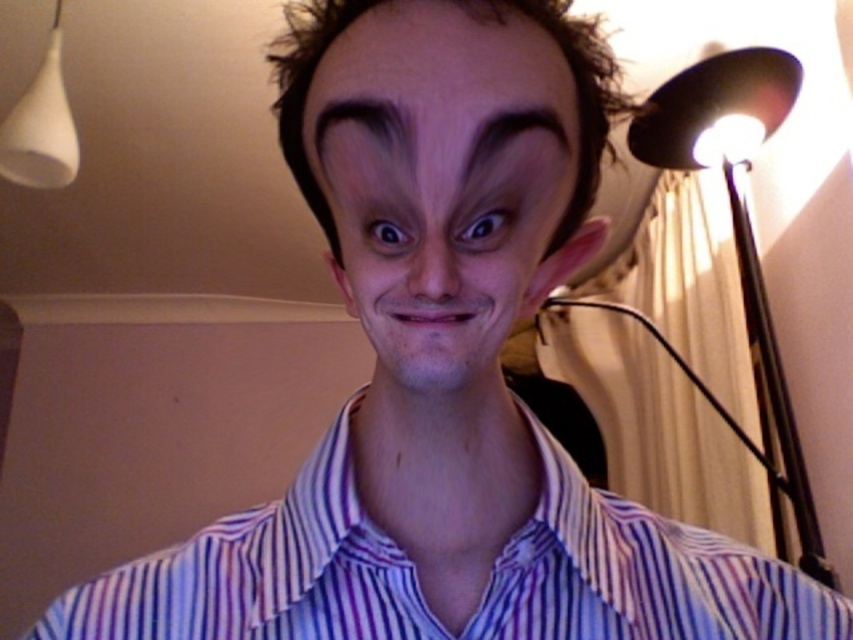
Question: Is black metal floor lamp at right in front of white matte lampshade at upper left?

Choices:
 (A) no
 (B) yes

Answer: (B)

Question: Which object appears farthest from the camera in this image?

Choices:
 (A) smooth skin face at center
 (B) dark brown hair at upper center

Answer: (B)

Question: Is purple striped shirt at center above dark brown hair at upper center?

Choices:
 (A) yes
 (B) no

Answer: (B)

Question: Which point is closer to the camera taking this photo?

Choices:
 (A) (288, 499)
 (B) (456, 266)

Answer: (B)

Question: Observing the image, what is the correct spatial positioning of dark purple hair at center in reference to black matte eye at center?

Choices:
 (A) below
 (B) above

Answer: (B)

Question: Estimate the real-world distances between objects in this image. Which object is closer to the purple striped shirt at center?

Choices:
 (A) black metal floor lamp at right
 (B) dark purple hair at center
 (C) dark brown furrowed eyebrow at upper center

Answer: (B)